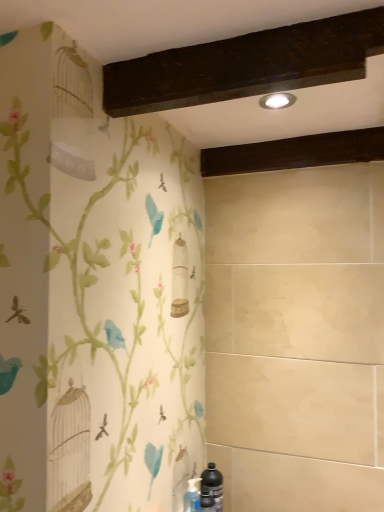
Question: Is dark wood beam at upper center to the left of black matte bottle at lower right from the viewer's perspective?

Choices:
 (A) no
 (B) yes

Answer: (A)

Question: Does dark wood beam at upper center have a greater width compared to black matte bottle at lower right?

Choices:
 (A) yes
 (B) no

Answer: (A)

Question: From a real-world perspective, is dark wood beam at upper center physically below black matte bottle at lower right?

Choices:
 (A) no
 (B) yes

Answer: (A)

Question: Is dark wood beam at upper center located outside black matte bottle at lower right?

Choices:
 (A) yes
 (B) no

Answer: (A)

Question: Is the depth of dark wood beam at upper center greater than that of black matte bottle at lower right?

Choices:
 (A) no
 (B) yes

Answer: (B)

Question: Is dark wood beam at upper center aimed at black matte bottle at lower right?

Choices:
 (A) yes
 (B) no

Answer: (B)

Question: Does dark wood beam at upper center turn towards matte silver light fixture at upper center?

Choices:
 (A) no
 (B) yes

Answer: (A)

Question: Considering the relative sizes of dark wood beam at upper center and matte silver light fixture at upper center in the image provided, is dark wood beam at upper center taller than matte silver light fixture at upper center?

Choices:
 (A) no
 (B) yes

Answer: (B)

Question: Considering the relative sizes of dark wood beam at upper center and matte silver light fixture at upper center in the image provided, is dark wood beam at upper center shorter than matte silver light fixture at upper center?

Choices:
 (A) yes
 (B) no

Answer: (B)

Question: Does dark wood beam at upper center have a lesser width compared to matte silver light fixture at upper center?

Choices:
 (A) yes
 (B) no

Answer: (B)

Question: Can you confirm if dark wood beam at upper center is positioned to the left of matte silver light fixture at upper center?

Choices:
 (A) yes
 (B) no

Answer: (B)

Question: Does dark wood beam at upper center have a greater width compared to matte silver light fixture at upper center?

Choices:
 (A) yes
 (B) no

Answer: (A)

Question: Does black matte bottle at lower right have a greater height compared to matte silver light fixture at upper center?

Choices:
 (A) no
 (B) yes

Answer: (B)